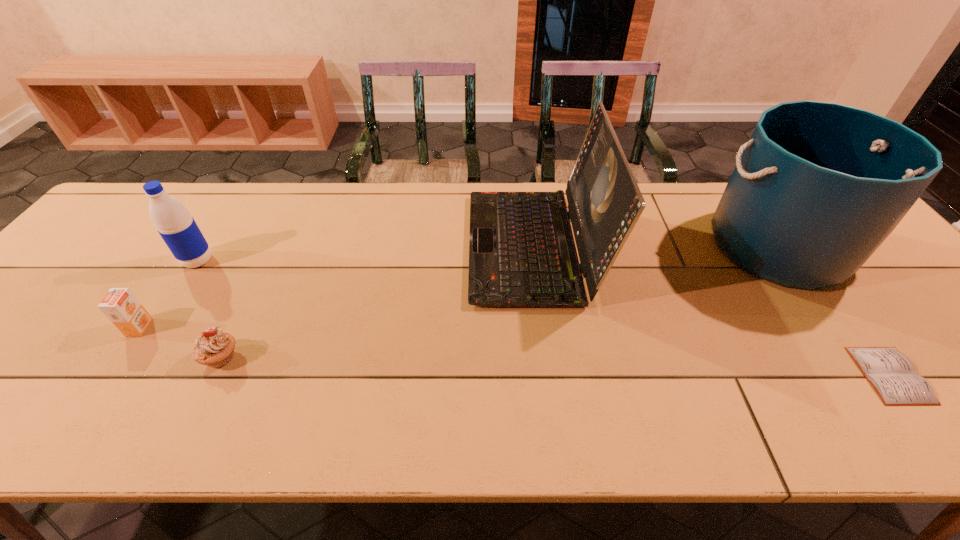
Locate an element on the screen. The width and height of the screenshot is (960, 540). object present at the far right corner is located at coordinates (819, 186).

You are a GUI agent. You are given a task and a screenshot of the screen. Output one action in this format:
    pyautogui.click(x=<x>, y=<y>)
    Task: Click on the vacant space at the far edge of the desktop
    This screenshot has width=960, height=540.
    Given the screenshot: What is the action you would take?
    pyautogui.click(x=335, y=206)

In the image, there is a desktop. At what (x,y) coordinates should I click in order to perform the action: click on vacant space at the near edge. Please return your answer as a coordinate pair (x, y). The height and width of the screenshot is (540, 960). Looking at the image, I should click on [x=774, y=422].

This screenshot has height=540, width=960. In the image, there is a desktop. Identify the location of vacant space at the left edge. (105, 281).

The image size is (960, 540). I want to click on free space between the bucket and the third nearest object, so click(459, 287).

I want to click on vacant space that's between the bucket and the third object from right to left, so click(656, 246).

The width and height of the screenshot is (960, 540). Find the location of `blank region between the water bottle and the fourth object from left to right`. blank region between the water bottle and the fourth object from left to right is located at coordinates (366, 253).

Where is `empty space between the bucket and the diary`? Image resolution: width=960 pixels, height=540 pixels. empty space between the bucket and the diary is located at coordinates (834, 310).

You are a GUI agent. You are given a task and a screenshot of the screen. Output one action in this format:
    pyautogui.click(x=<x>, y=<y>)
    Task: Click on the vacant space that is in between the fourth farthest object and the water bottle
    
    Given the screenshot: What is the action you would take?
    (x=169, y=294)

Identify the location of blank region between the fourth object from left to right and the cupcake. (376, 302).